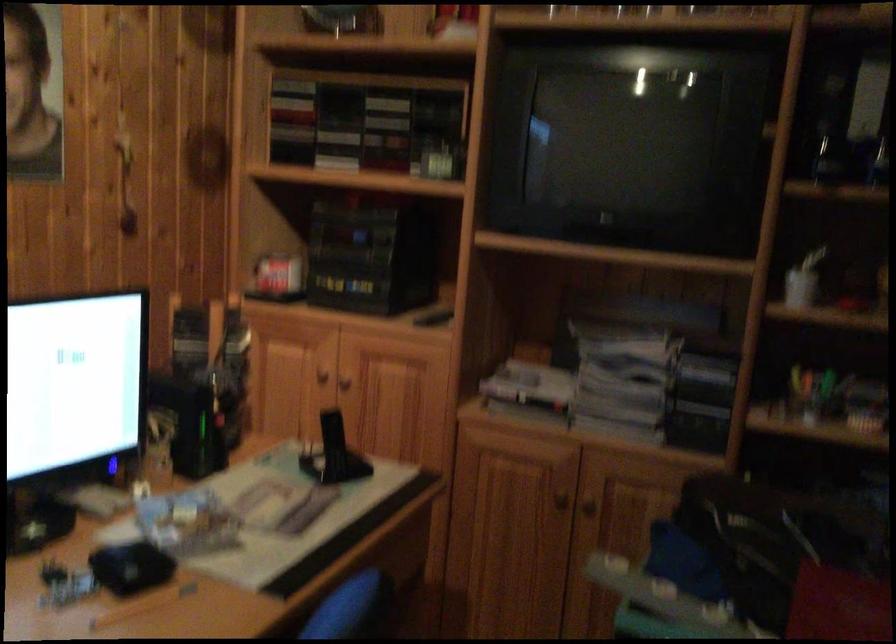
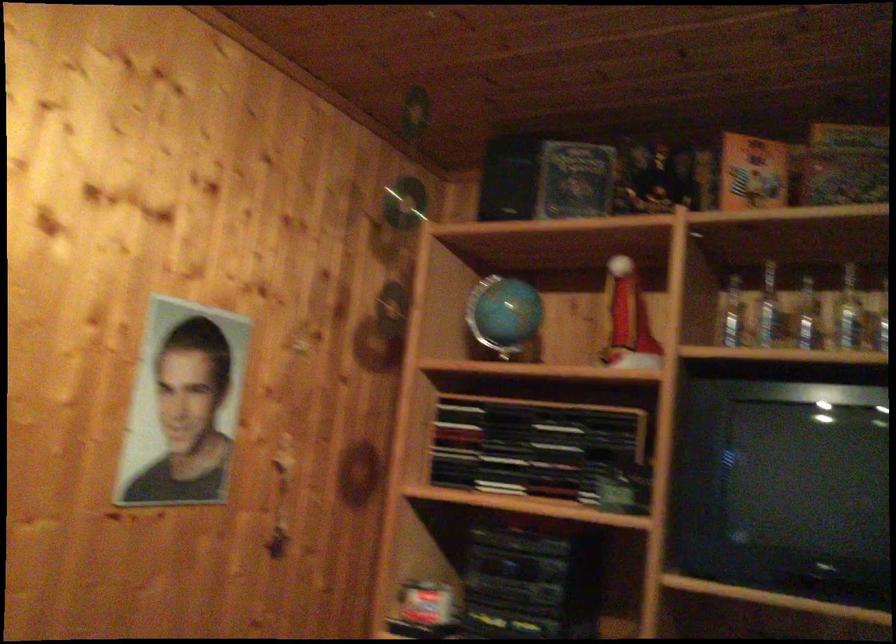
Question: The images are taken continuously from a first-person perspective. In which direction is your viewpoint rotating?

Choices:
 (A) Left
 (B) Right
 (C) Up
 (D) Down

Answer: (C)